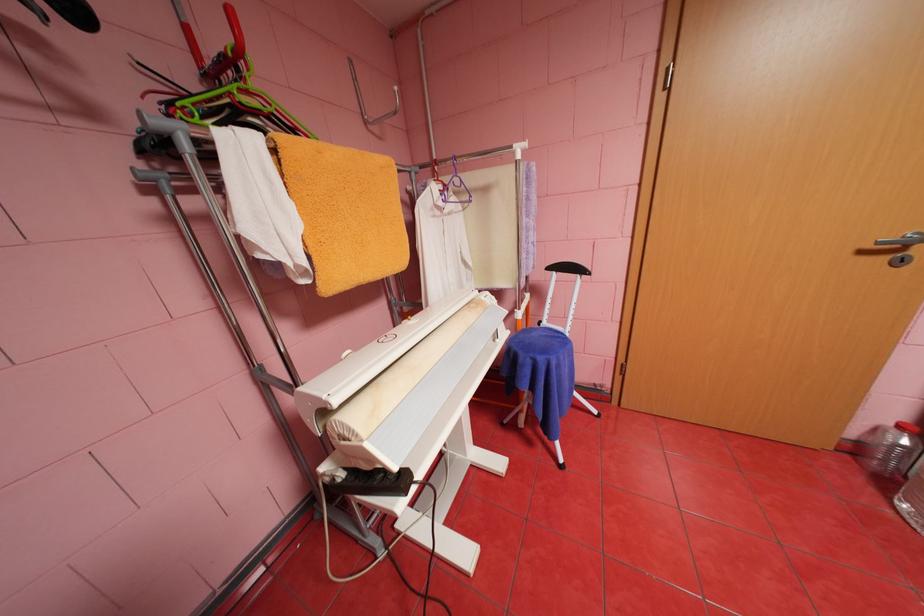
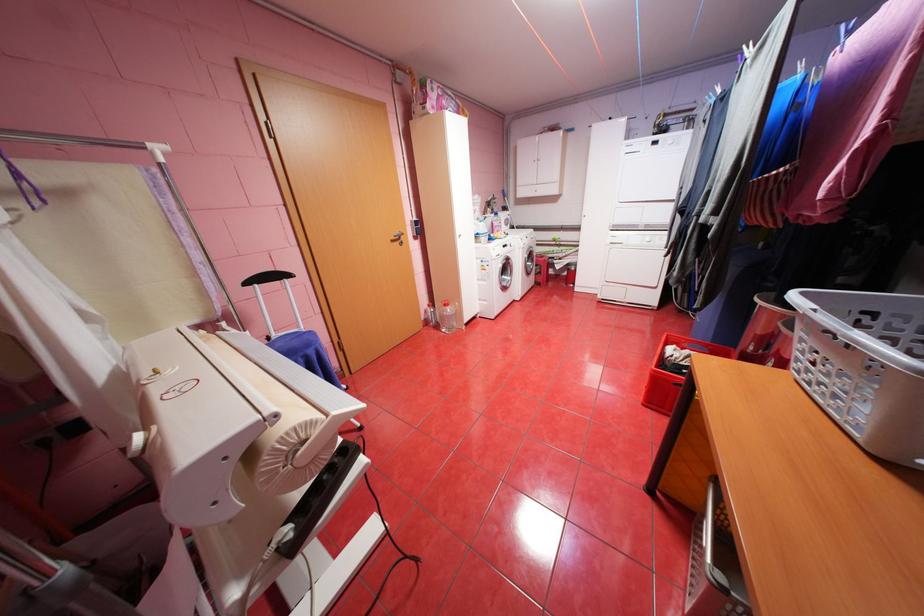
The point at (x=870, y=252) is marked in the first image. Where is the corresponding point in the second image?

(400, 241)